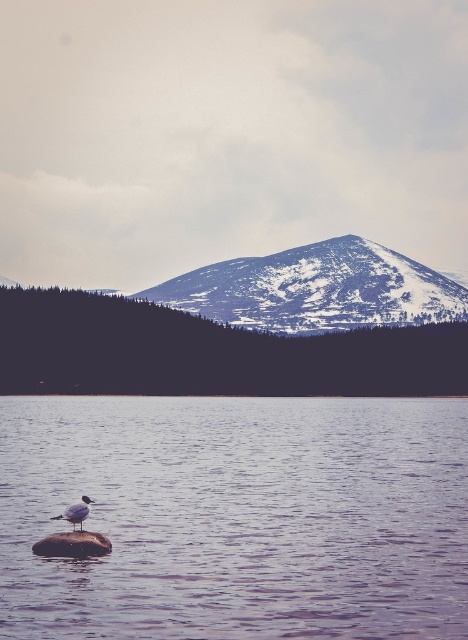
Is snowy rock formation at center wider than brown rough stone at lower left?

Yes.

Is point (232, 305) behind point (74, 552)?

Yes.

The width and height of the screenshot is (468, 640). I want to click on snowy rock formation at center, so click(x=315, y=289).

Looking at this image, can you confirm if smooth water at center is smaller than snowy rock formation at center?

No, smooth water at center is not smaller than snowy rock formation at center.

Based on the photo, does smooth water at center appear on the right side of snowy rock formation at center?

In fact, smooth water at center is to the left of snowy rock formation at center.

The height and width of the screenshot is (640, 468). Find the location of `smooth water at center`. smooth water at center is located at coordinates (236, 516).

Between smooth water at center and brown rough stone at lower left, which one has less height?

brown rough stone at lower left

Who is positioned more to the left, smooth water at center or brown rough stone at lower left?

From the viewer's perspective, brown rough stone at lower left appears more on the left side.

You are a GUI agent. You are given a task and a screenshot of the screen. Output one action in this format:
    pyautogui.click(x=<x>, y=<y>)
    Task: Click on the smooth water at center
    The width and height of the screenshot is (468, 640).
    Given the screenshot: What is the action you would take?
    236,516